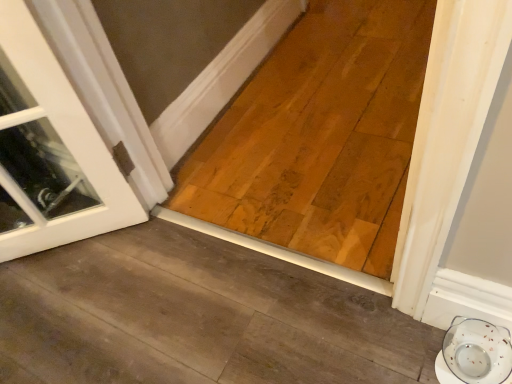
What do you see at coordinates (319, 136) in the screenshot?
I see `natural wood plank at center` at bounding box center [319, 136].

This screenshot has height=384, width=512. Identify the location of natural wood plank at center. (319, 136).

What is the approximate width of natural wood plank at center?

It is 4.68 feet.

Find the location of a particular element. white glossy saucer at lower right is located at coordinates (477, 351).

Describe the element at coordinates (477, 351) in the screenshot. I see `white glossy saucer at lower right` at that location.

In order to face white glossy saucer at lower right, should I rotate leftwards or rightwards?

You should look right and rotate roughly 30.667 degrees.

Where is `natural wood plank at center`? natural wood plank at center is located at coordinates (x=319, y=136).

Would you say white glossy saucer at lower right is to the left or to the right of natural wood plank at center in the picture?

white glossy saucer at lower right is to the right of natural wood plank at center.

Consider the image. Is white glossy saucer at lower right positioned before natural wood plank at center?

Yes, it is in front of natural wood plank at center.

Does point (506, 343) come in front of point (279, 99)?

Yes, point (506, 343) is in front of point (279, 99).

From the image's perspective, is white glossy saucer at lower right beneath natural wood plank at center?

Yes, from the image's perspective, white glossy saucer at lower right is beneath natural wood plank at center.

From a real-world perspective, is white glossy saucer at lower right positioned above or below natural wood plank at center?

From a real-world perspective, white glossy saucer at lower right is physically above natural wood plank at center.

Can you confirm if white glossy saucer at lower right is thinner than natural wood plank at center?

Yes, white glossy saucer at lower right is thinner than natural wood plank at center.

Consider the image. Who is taller, white glossy saucer at lower right or natural wood plank at center?

white glossy saucer at lower right.

Considering the sizes of objects white glossy saucer at lower right and natural wood plank at center in the image provided, who is bigger, white glossy saucer at lower right or natural wood plank at center?

With larger size is natural wood plank at center.

Is white glossy saucer at lower right surrounding natural wood plank at center?

No, natural wood plank at center is not inside white glossy saucer at lower right.

Is white glossy saucer at lower right in contact with natural wood plank at center?

No, white glossy saucer at lower right is not with natural wood plank at center.

Could you tell me if white glossy saucer at lower right is turned towards natural wood plank at center?

No, white glossy saucer at lower right is not oriented towards natural wood plank at center.

What's the angular difference between white glossy saucer at lower right and natural wood plank at center's facing directions?

They differ by 0.5 degrees in their facing directions.

The height and width of the screenshot is (384, 512). I want to click on plank that appears above the white glossy saucer at lower right (from the image's perspective), so click(319, 136).

Based on their positions, is natural wood plank at center located to the left or right of white glossy saucer at lower right?

Based on their positions, natural wood plank at center is located to the left of white glossy saucer at lower right.

Considering their positions, is natural wood plank at center located in front of or behind white glossy saucer at lower right?

Visually, natural wood plank at center is located behind white glossy saucer at lower right.

Is point (365, 5) more distant than point (467, 348)?

That is True.

From the image's perspective, which one is positioned lower, natural wood plank at center or white glossy saucer at lower right?

white glossy saucer at lower right.

From a real-world perspective, which is physically below, natural wood plank at center or white glossy saucer at lower right?

natural wood plank at center is physically lower.

Which object is wider, natural wood plank at center or white glossy saucer at lower right?

natural wood plank at center is wider.

Which of these two, natural wood plank at center or white glossy saucer at lower right, stands taller?

Standing taller between the two is white glossy saucer at lower right.

Is natural wood plank at center bigger or smaller than white glossy saucer at lower right?

natural wood plank at center is bigger than white glossy saucer at lower right.

Can white glossy saucer at lower right be found inside natural wood plank at center?

No, white glossy saucer at lower right is not a part of natural wood plank at center.

Is natural wood plank at center not close to white glossy saucer at lower right?

No, natural wood plank at center is not far from white glossy saucer at lower right.

Is natural wood plank at center positioned with its back to white glossy saucer at lower right?

No, natural wood plank at center's orientation is not away from white glossy saucer at lower right.

Where is `plank on the left of white glossy saucer at lower right`? plank on the left of white glossy saucer at lower right is located at coordinates (319, 136).

This screenshot has height=384, width=512. Identify the location of plank that is on the left side of white glossy saucer at lower right. (319, 136).

You are a GUI agent. You are given a task and a screenshot of the screen. Output one action in this format:
    pyautogui.click(x=<x>, y=<y>)
    Task: Click on the saucer located above the natural wood plank at center (from a real-world perspective)
    This screenshot has height=384, width=512.
    Given the screenshot: What is the action you would take?
    (477, 351)